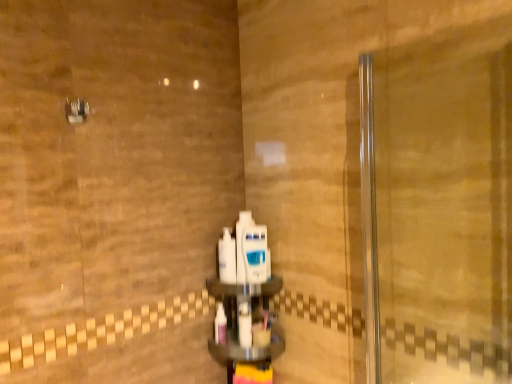
Question: Visually, is white glossy mouthwash at center, arranged as the 3th mouthwash when ordered from the bottom, positioned to the left or to the right of white glossy mouthwash at center, arranged as the first mouthwash when viewed from the top?

Choices:
 (A) left
 (B) right

Answer: (B)

Question: Considering the positions of white glossy mouthwash at center, positioned as the second mouthwash in top-to-bottom order, and white glossy mouthwash at center, which is the fourth mouthwash from bottom to top, in the image, is white glossy mouthwash at center, positioned as the second mouthwash in top-to-bottom order, taller or shorter than white glossy mouthwash at center, which is the fourth mouthwash from bottom to top,?

Choices:
 (A) tall
 (B) short

Answer: (B)

Question: Which of these objects is positioned closest to the white glossy mouthwash at center, arranged as the 3th mouthwash when ordered from the bottom?

Choices:
 (A) white glossy mouthwash at center, arranged as the 2th mouthwash when ordered from the bottom
 (B) clear glass screen door at right
 (C) white glossy mouthwash at center, which is the fourth mouthwash from bottom to top
 (D) metallic silver showerhead at upper left
 (E) white plastic mouthwash at center, positioned as the 4th mouthwash in top-to-bottom order

Answer: (C)

Question: Based on their relative distances, which object is nearer to the white plastic mouthwash at center, positioned as the 4th mouthwash in top-to-bottom order?

Choices:
 (A) clear glass screen door at right
 (B) white glossy mouthwash at center, which is the fourth mouthwash from bottom to top
 (C) white glossy mouthwash at center, arranged as the 2th mouthwash when ordered from the bottom
 (D) white plastic toothbrush at center
 (E) white glossy mouthwash at center, positioned as the second mouthwash in top-to-bottom order

Answer: (D)